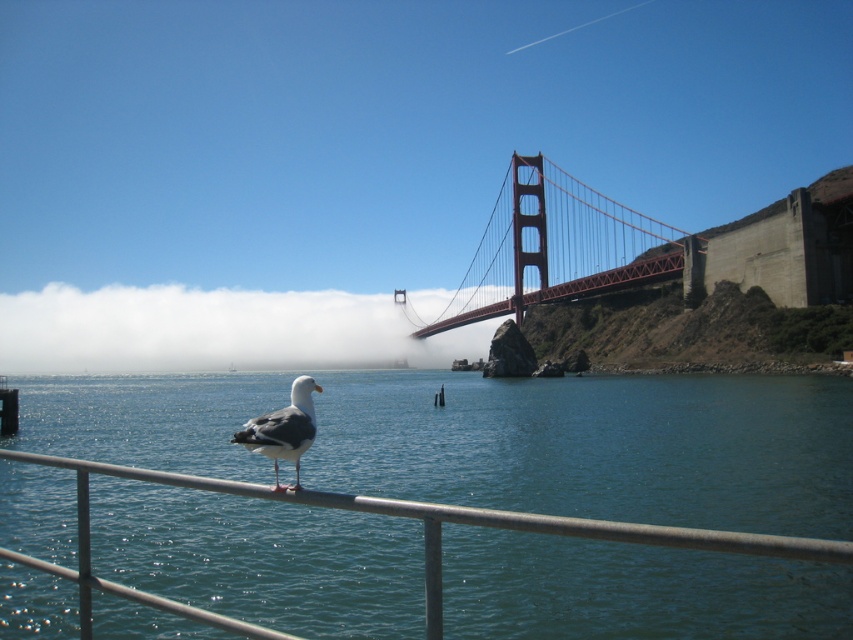
Can you confirm if blue water at center is positioned above red painted steel golden gate bridge at center?

No.

Can you confirm if blue water at center is thinner than red painted steel golden gate bridge at center?

No, blue water at center is not thinner than red painted steel golden gate bridge at center.

Is point (405, 634) more distant than point (576, 248)?

No, (405, 634) is in front of (576, 248).

Locate an element on the screen. blue water at center is located at coordinates (596, 445).

Can you confirm if red painted steel golden gate bridge at center is thinner than white feathered bird at center?

Incorrect, red painted steel golden gate bridge at center's width is not less than white feathered bird at center's.

Looking at this image, is red painted steel golden gate bridge at center to the left of white feathered bird at center from the viewer's perspective?

No, red painted steel golden gate bridge at center is not to the left of white feathered bird at center.

The height and width of the screenshot is (640, 853). Find the location of `red painted steel golden gate bridge at center`. red painted steel golden gate bridge at center is located at coordinates (554, 246).

Does white misty fog at center have a lesser height compared to white feathered bird at center?

Incorrect, white misty fog at center's height does not fall short of white feathered bird at center's.

Between white misty fog at center and white feathered bird at center, which one appears on the left side from the viewer's perspective?

white misty fog at center is more to the left.

Describe the element at coordinates (213, 330) in the screenshot. The width and height of the screenshot is (853, 640). I see `white misty fog at center` at that location.

Locate an element on the screen. The width and height of the screenshot is (853, 640). white misty fog at center is located at coordinates coord(213,330).